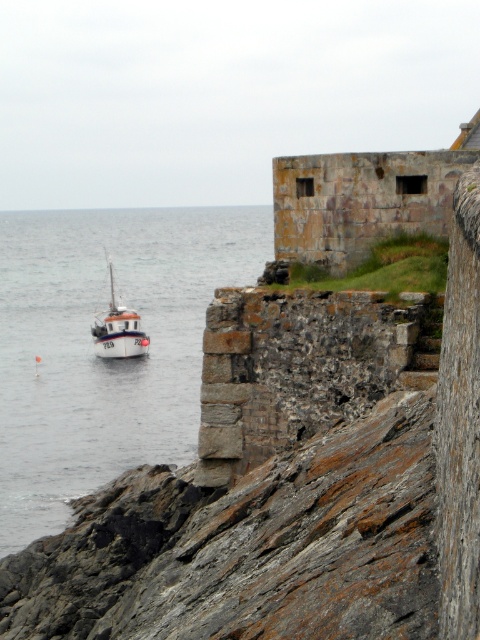
Question: Does clear water at left have a smaller size compared to white matte boat at left?

Choices:
 (A) no
 (B) yes

Answer: (A)

Question: From the image, what is the correct spatial relationship of clear water at left in relation to white matte boat at left?

Choices:
 (A) above
 (B) below

Answer: (A)

Question: Is clear water at left to the right of white matte boat at left from the viewer's perspective?

Choices:
 (A) no
 (B) yes

Answer: (A)

Question: Which point is farther to the camera?

Choices:
 (A) (134, 257)
 (B) (136, 352)

Answer: (A)

Question: Which point is closer to the camera?

Choices:
 (A) white matte boat at left
 (B) clear water at left

Answer: (B)